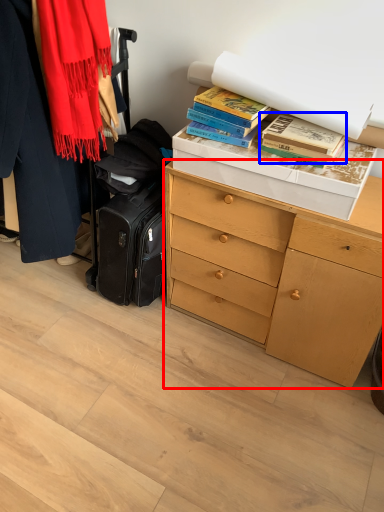
Question: Among these objects, which one is farthest to the camera, chest of drawers (highlighted by a red box) or book (highlighted by a blue box)?

Choices:
 (A) chest of drawers
 (B) book

Answer: (B)